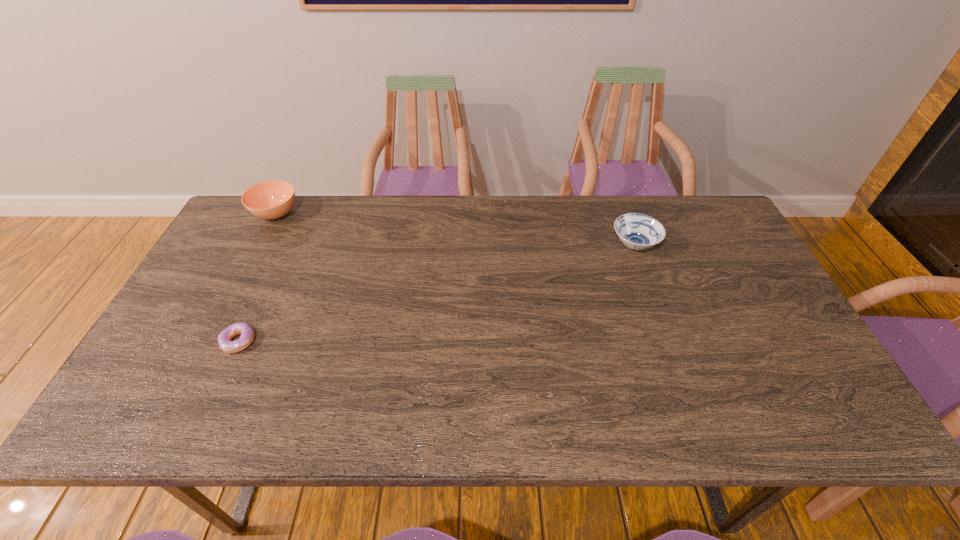
Locate an element on the screen. Image resolution: width=960 pixels, height=540 pixels. free spot that satisfies the following two spatial constraints: 1. on the back side of the nearest object; 2. on the left side of the second shortest object is located at coordinates (283, 246).

At what (x,y) coordinates should I click in order to perform the action: click on blank space that satisfies the following two spatial constraints: 1. on the back side of the right soup bowl; 2. on the right side of the shortest object. Please return your answer as a coordinate pair (x, y). Looking at the image, I should click on (283, 246).